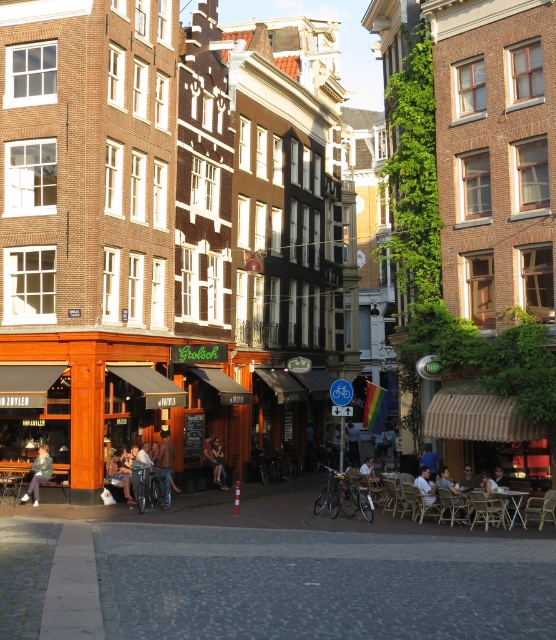
Who is more distant from viewer, (210,465) or (505,492)?

The point (210,465) is behind.

Which of these two, dark blue fabric jacket at center or metallic silver table at center, stands shorter?

metallic silver table at center is shorter.

Who is more distant from viewer, (210, 451) or (518, 516)?

The point (210, 451) is more distant.

The height and width of the screenshot is (640, 556). I want to click on dark blue fabric jacket at center, so click(x=214, y=461).

Is wooden table at lower left positioned at the back of dark blue fabric jacket at center?

That is False.

Which is behind, point (18, 474) or point (215, 472)?

Point (215, 472)

Where is `wooden table at lower left`? This screenshot has width=556, height=640. wooden table at lower left is located at coordinates (12, 483).

Between wooden chair at center and metallic silver table at center, which one appears on the left side from the viewer's perspective?

wooden chair at center

Is wooden chair at center wider than metallic silver table at center?

No.

You are a GUI agent. You are given a task and a screenshot of the screen. Output one action in this format:
    pyautogui.click(x=<x>, y=<y>)
    Task: Click on the wooden chair at center
    This screenshot has width=556, height=640.
    Given the screenshot: What is the action you would take?
    pyautogui.click(x=120, y=472)